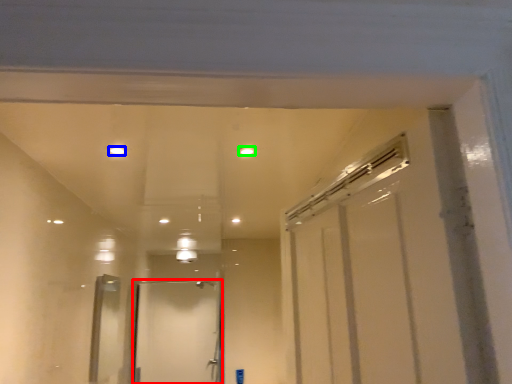
Question: Based on their relative distances, which object is farther from door (highlighted by a red box)? Choose from light (highlighted by a blue box) and light (highlighted by a green box).

Choices:
 (A) light
 (B) light

Answer: (B)